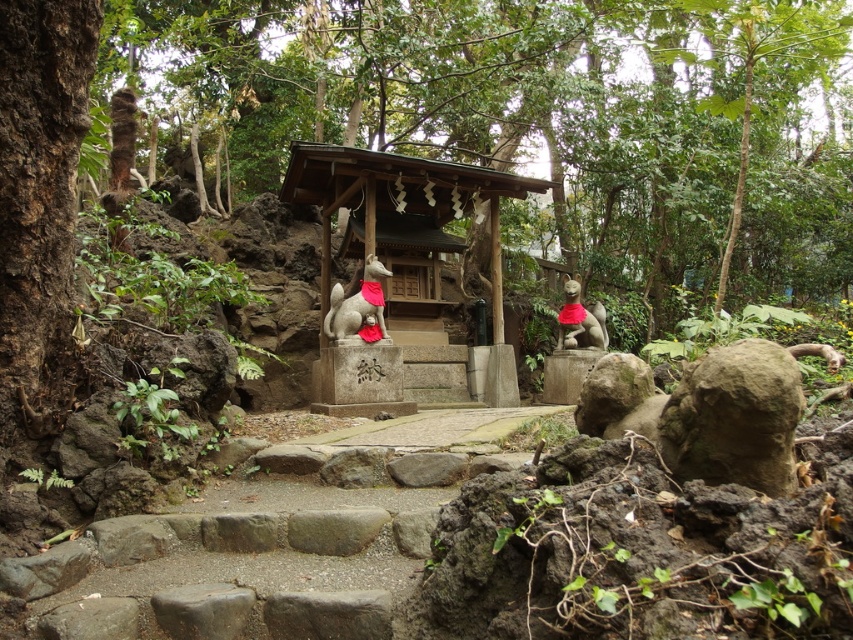
You are a photographer standing at the camera position. The smooth stone gazebo at center is your main subject. Can you fit the entire gazebo into your camera frame without moving? The camera has a field of view of 6 meters.

The smooth stone gazebo at center and camera are 7.05 meters apart. Since the distance between them is greater than the camera field of view of 6 meters, you cannot fit the entire gazebo into the frame without moving closer.

You are a visitor at the shrine and want to place an offering on the smooth stone gazebo at center. You are currently standing 4 feet away from the matte gray fox at center. Can you reach the gazebo without moving closer to the fox?

The smooth stone gazebo at center is 3.40 feet away from the matte gray fox at center. Since you are 4 feet away from the matte gray fox at center, you are farther away than the distance between the gazebo and the fox. Therefore, you cannot reach the gazebo without moving closer to the matte gray fox at center.

You are standing at the entrance of the shrine and want to walk to the point marked as point (323, 253). Which direction should you move relative to the point (558, 316)?

You should move behind the point (558, 316) to reach the point (323, 253) because the point (323, 253) is located behind point (558, 316).